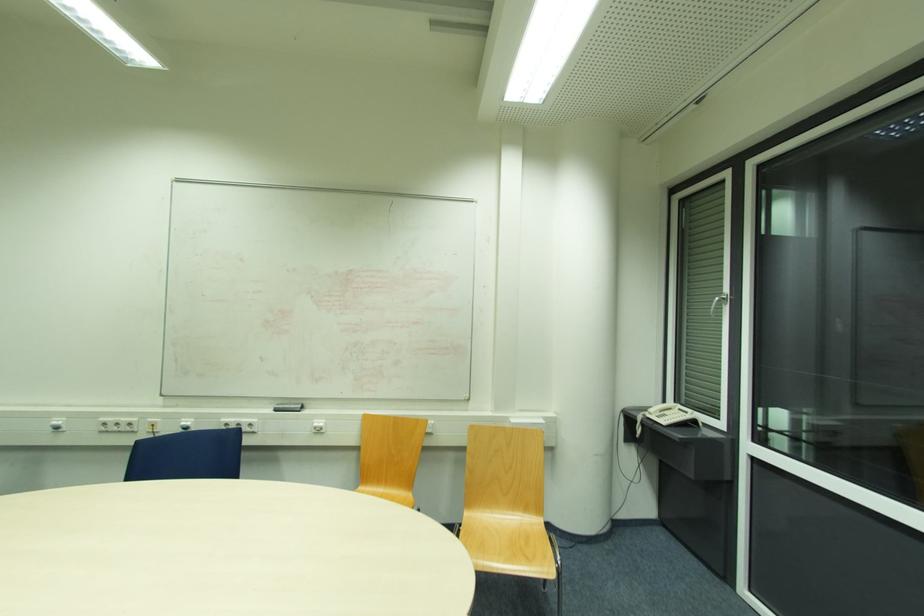
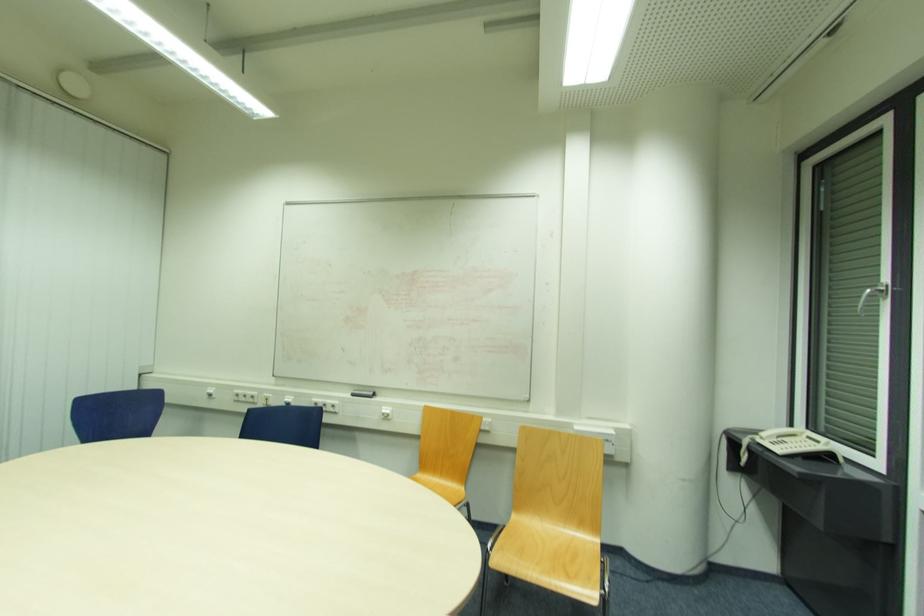
Locate, in the second image, the point that corresponds to [671,410] in the first image.

(793, 436)